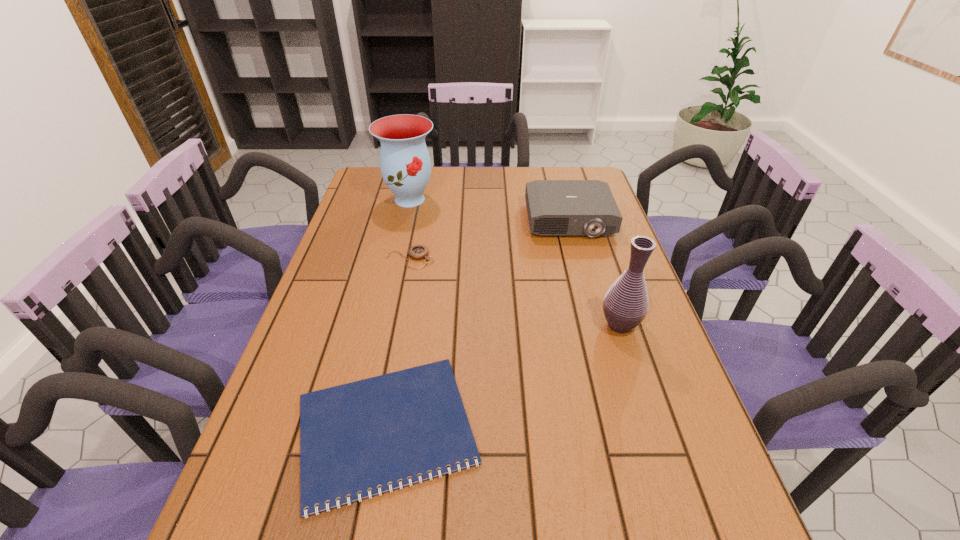
The height and width of the screenshot is (540, 960). In order to click on vacant space located 0.400m on the front-facing side of the projector in this screenshot , I will do `click(599, 333)`.

Where is `vacant region located on the right of the second shortest object`? vacant region located on the right of the second shortest object is located at coordinates pyautogui.click(x=473, y=259).

Find the location of a particular element. The image size is (960, 540). free space located 0.110m on the right of the nearest object is located at coordinates (534, 429).

Identify the location of object that is at the far edge. This screenshot has height=540, width=960. (405, 164).

This screenshot has width=960, height=540. Find the location of `vase that is at the left edge`. vase that is at the left edge is located at coordinates (405, 164).

Where is `notepad located at the left edge`? This screenshot has height=540, width=960. notepad located at the left edge is located at coordinates (359, 436).

Where is `vase that is at the right edge`? vase that is at the right edge is located at coordinates (625, 306).

Identify the location of projector at the right edge. The image size is (960, 540). (555, 207).

Where is `object present at the far left corner`? The height and width of the screenshot is (540, 960). object present at the far left corner is located at coordinates (405, 164).

Find the location of a particular element. vacant space at the far edge of the desktop is located at coordinates (512, 171).